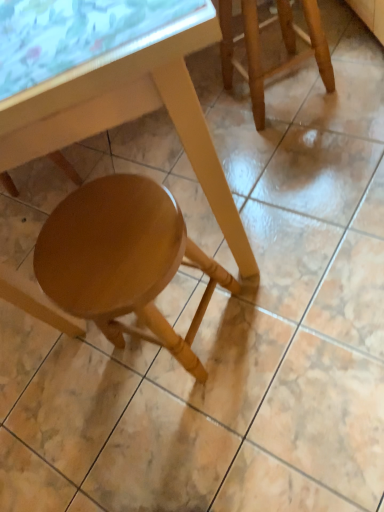
Locate an element on the screen. The height and width of the screenshot is (512, 384). blank space situated above glossy wood stool at lower center, which is counted as the 2th stool, starting from the right (from a real-world perspective) is located at coordinates (98, 241).